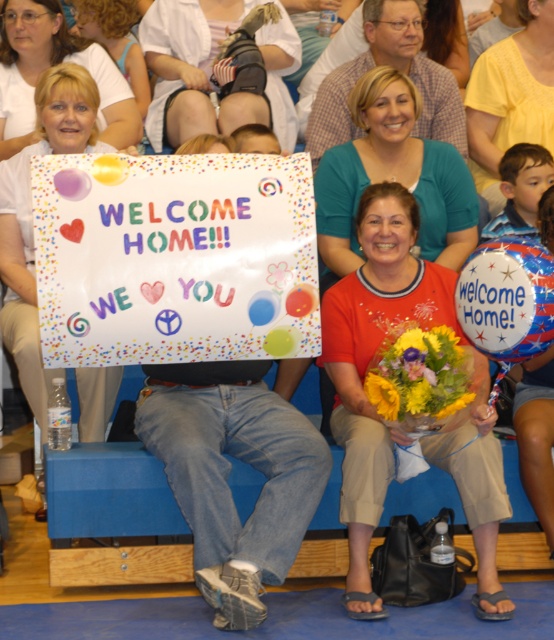
Question: Can you confirm if matte black knee brace at center is thinner than teal fabric shirt at upper center?

Choices:
 (A) no
 (B) yes

Answer: (B)

Question: Which object is positioned farthest from the matte black knee brace at center?

Choices:
 (A) yellow cotton shirt at center
 (B) matte red shirt at center
 (C) denim shorts at lower right
 (D) teal fabric shirt at upper center

Answer: (C)

Question: Considering the real-world distances, which object is closest to the teal fabric shirt at upper center?

Choices:
 (A) yellow matte flower at center
 (B) yellow cotton shirt at center
 (C) matte black knee brace at center
 (D) denim shorts at lower right

Answer: (B)

Question: Observing the image, what is the correct spatial positioning of matte red shirt at center in reference to denim shorts at lower right?

Choices:
 (A) below
 (B) above

Answer: (B)

Question: Among these objects, which one is farthest from the camera?

Choices:
 (A) teal fabric shirt at upper center
 (B) yellow cotton shirt at center
 (C) matte red shirt at center

Answer: (B)

Question: Is teal fabric shirt at upper center further to camera compared to denim shorts at lower right?

Choices:
 (A) yes
 (B) no

Answer: (A)